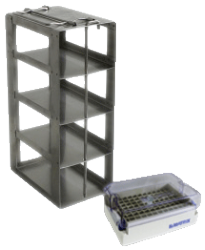
The image size is (205, 250). I want to click on floor, so click(x=39, y=203).